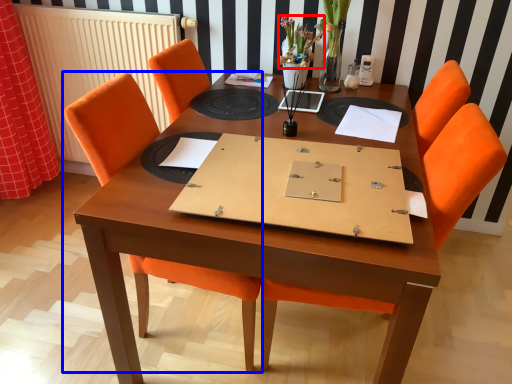
Question: Which point is further to the camera, flower (highlighted by a red box) or chair (highlighted by a blue box)?

Choices:
 (A) flower
 (B) chair

Answer: (A)